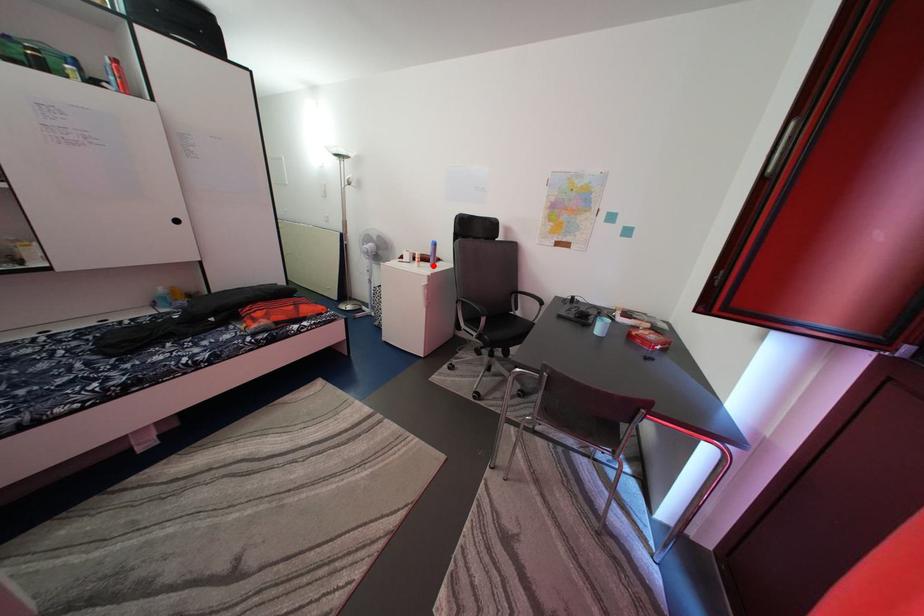
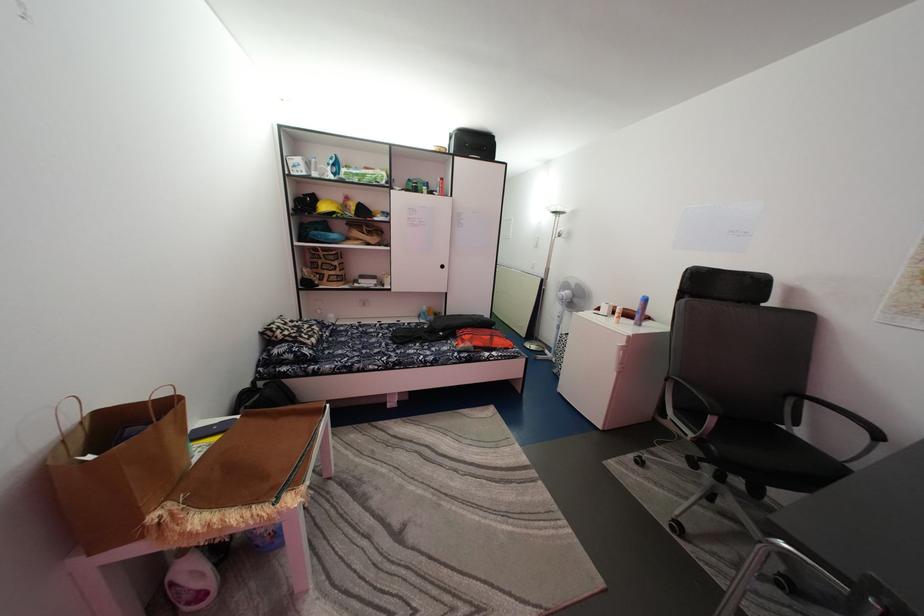
Find the pixel in the second image that matches the highlighted location in the first image.

(637, 322)